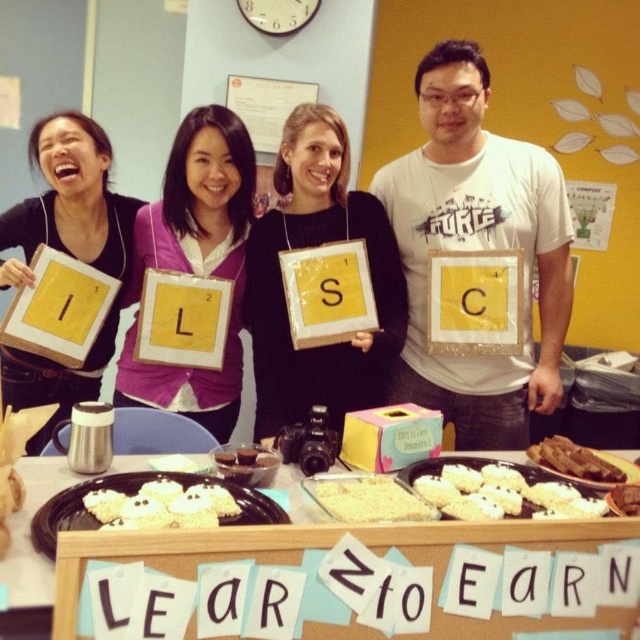
Question: Based on their relative distances, which object is nearer to the white fluffy cookies at lower center?

Choices:
 (A) brown crispy meat at center
 (B) white matte platter at center
 (C) white rice cake at center
 (D) brown crispy bread at lower right

Answer: (B)

Question: Is white matte platter at center closer to the viewer compared to white frosted cupcake at center?

Choices:
 (A) yes
 (B) no

Answer: (A)

Question: Does matte yellow square at upper left appear on the right side of white rice cake at center?

Choices:
 (A) yes
 (B) no

Answer: (B)

Question: Among these objects, which one is farthest from the camera?

Choices:
 (A) white frosted cupcake at center
 (B) white matte t-shirt at center
 (C) white crumbly cake at center

Answer: (B)

Question: Which of the following is the farthest from the observer?

Choices:
 (A) white crumbly cake at center
 (B) white frosted cupcake at center
 (C) white matte platter at center
 (D) white matte t-shirt at center

Answer: (D)

Question: Is white matte t-shirt at center to the left of brown crispy meat at center from the viewer's perspective?

Choices:
 (A) no
 (B) yes

Answer: (B)